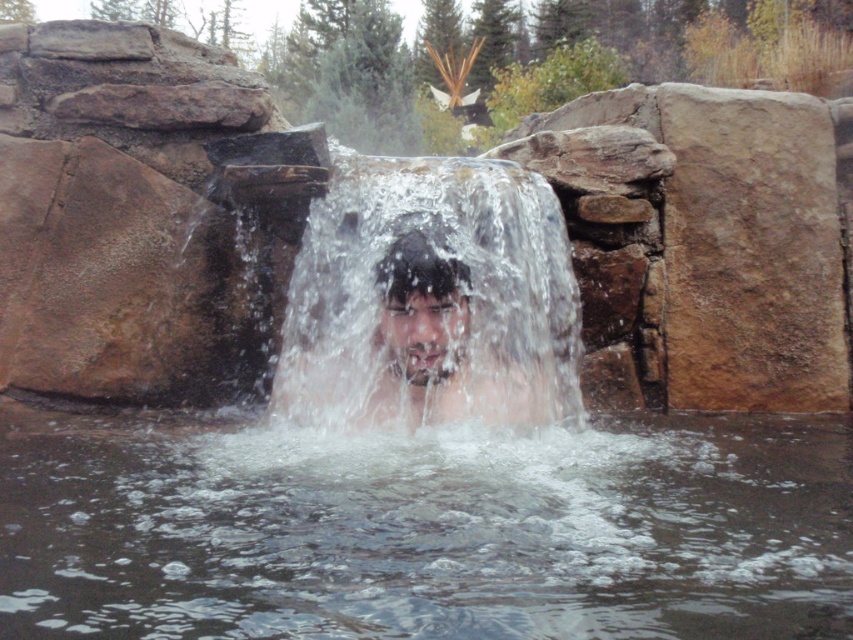
You are standing at the edge of the waterfall in the scene. There is a point marked at coordinates (424, 531). What is located at that point?

The point at coordinates (424, 531) indicates clear liquid water at center.

You are a swimmer who wants to dive into the water in the scene. You see the clear liquid water at center and the clear water at center. Which one is the deeper part of the water?

The clear liquid water at center is located below clear water at center, so the clear liquid water at center is the deeper part of the water.

You are a swimmer trying to locate the deepest part of the water area in the scene. According to the image, which object represents the deeper section between the clear liquid water at center and the clear water at center?

The clear liquid water at center is not as tall as clear water at center, so the clear water at center is deeper.